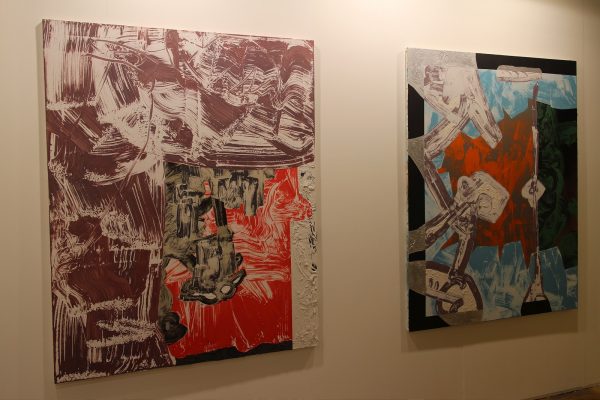
The width and height of the screenshot is (600, 400). Find the location of `shadow on wall below paintings`. shadow on wall below paintings is located at coordinates (231, 366), (490, 329).